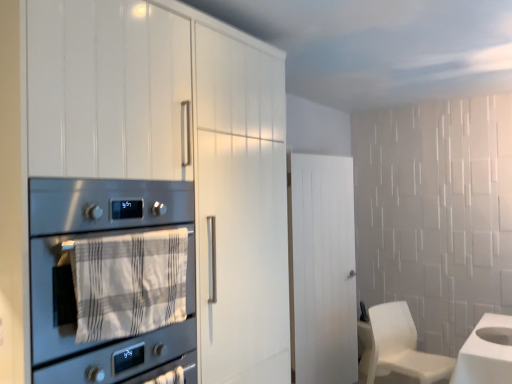
At what (x,y) coordinates should I click in order to perform the action: click on white matte chair at lower right. Please return your answer as a coordinate pair (x, y). Looking at the image, I should click on [x=398, y=347].

Image resolution: width=512 pixels, height=384 pixels. Describe the element at coordinates (398, 347) in the screenshot. I see `white matte chair at lower right` at that location.

What do you see at coordinates (178, 149) in the screenshot? I see `white matte cabinet at left` at bounding box center [178, 149].

This screenshot has height=384, width=512. Find the location of `stainless steel oven at left`. stainless steel oven at left is located at coordinates (100, 237).

Can you tell me how much white matte cabinet at left and white matte chair at lower right differ in facing direction?

There is a 18.8-degree angle between the facing directions of white matte cabinet at left and white matte chair at lower right.

From a real-world perspective, is white matte cabinet at left physically located above or below white matte chair at lower right?

white matte cabinet at left is situated higher than white matte chair at lower right in the real world.

Does white matte cabinet at left come behind white matte chair at lower right?

That is False.

Is white matte cabinet at left facing towards white matte chair at lower right?

No, white matte cabinet at left is not oriented towards white matte chair at lower right.

Is white wood door at center to the left or to the right of white matte cabinet at left in the image?

From the image, it's evident that white wood door at center is to the right of white matte cabinet at left.

In the scene shown: Is white wood door at center behind white matte cabinet at left?

Yes, the depth of white wood door at center is greater than that of white matte cabinet at left.

From a real-world perspective, is white wood door at center positioned over white matte cabinet at left based on gravity?

No, from a real-world perspective, white wood door at center is not on top of white matte cabinet at left.

The image size is (512, 384). In the image, there is a white matte cabinet at left. Identify the location of door below it (from a real-world perspective). (322, 269).

Who is shorter, stainless steel oven at left or white textured towel at center?

Standing shorter between the two is white textured towel at center.

Considering the positions of objects stainless steel oven at left and white textured towel at center in the image provided, who is in front, stainless steel oven at left or white textured towel at center?

stainless steel oven at left is more forward.

From a real-world perspective, is stainless steel oven at left positioned over white textured towel at center based on gravity?

No, from a real-world perspective, stainless steel oven at left is not above white textured towel at center.

Who is bigger, stainless steel oven at left or white textured towel at center?

With larger size is stainless steel oven at left.

Could white textured towel at center be considered to be inside white matte chair at lower right?

No, white textured towel at center is not inside white matte chair at lower right.

Can you confirm if white matte chair at lower right is shorter than white textured towel at center?

Incorrect, the height of white matte chair at lower right does not fall short of that of white textured towel at center.

Based on the photo, is white matte chair at lower right turned away from white textured towel at center?

No, white matte chair at lower right's orientation is not away from white textured towel at center.

Is point (380, 315) positioned in front of point (154, 301)?

That is False.

Which is farther, (49,300) or (196,149)?

Positioned behind is point (196,149).

From a real-world perspective, is stainless steel oven at left located beneath white matte cabinet at left?

Correct, in the physical world, stainless steel oven at left is lower than white matte cabinet at left.

Between stainless steel oven at left and white matte cabinet at left, which one has more height?

white matte cabinet at left is taller.

Is stainless steel oven at left in contact with white matte cabinet at left?

No, stainless steel oven at left is not next to white matte cabinet at left.

Is there a large distance between white wood door at center and white matte chair at lower right?

No, white wood door at center is not far from white matte chair at lower right.

Which is behind, white wood door at center or white matte chair at lower right?

white wood door at center.

From the image's perspective, between white wood door at center and white matte chair at lower right, who is located below?

white matte chair at lower right, from the image's perspective.

Considering the sizes of objects white wood door at center and white matte chair at lower right in the image provided, who is taller, white wood door at center or white matte chair at lower right?

white wood door at center.

In terms of width, does white wood door at center look wider or thinner when compared to stainless steel oven at left?

Considering their sizes, white wood door at center looks slimmer than stainless steel oven at left.

Is white wood door at center turned away from stainless steel oven at left?

white wood door at center is not turned away from stainless steel oven at left.

From the image's perspective, which one is positioned higher, white wood door at center or stainless steel oven at left?

stainless steel oven at left appears higher in the image.

Is point (313, 293) behind point (143, 342)?

Yes, point (313, 293) is behind point (143, 342).

At what (x,y) coordinates should I click in order to perform the action: click on cabinetry above the white matte chair at lower right (from a real-world perspective). Please return your answer as a coordinate pair (x, y). This screenshot has height=384, width=512. Looking at the image, I should click on (178, 149).

Find the location of `cabinetry above the white wood door at center (from the image's perspective)`. cabinetry above the white wood door at center (from the image's perspective) is located at coordinates (178, 149).

Estimate the real-world distances between objects in this image. Which object is closer to white matte cabinet at left, white wood door at center or stainless steel oven at left?

The object closer to white matte cabinet at left is stainless steel oven at left.

Considering their positions, is white matte cabinet at left positioned closer to white wood door at center than white matte chair at lower right?

Based on the image, white matte chair at lower right appears to be nearer to white wood door at center.

From the image, which object appears to be nearer to white matte chair at lower right, white wood door at center or stainless steel oven at left?

white wood door at center lies closer to white matte chair at lower right than the other object.

Based on their spatial positions, is white matte cabinet at left or stainless steel oven at left further from white textured towel at center?

white matte cabinet at left is further to white textured towel at center.

Considering their positions, is white matte chair at lower right positioned closer to white wood door at center than white textured towel at center?

white matte chair at lower right is closer to white wood door at center.

Estimate the real-world distances between objects in this image. Which object is closer to white matte chair at lower right, white textured towel at center or stainless steel oven at left?

stainless steel oven at left.

Looking at the image, which one is located closer to white matte cabinet at left, white matte chair at lower right or stainless steel oven at left?

stainless steel oven at left is positioned closer to the anchor white matte cabinet at left.

From the image, which object appears to be nearer to white textured towel at center, white matte cabinet at left or white wood door at center?

white matte cabinet at left lies closer to white textured towel at center than the other object.

What are the coordinates of `cabinetry located between stainless steel oven at left and white matte chair at lower right in the left-right direction` in the screenshot? It's located at (x=178, y=149).

At what (x,y) coordinates should I click in order to perform the action: click on chair positioned between stainless steel oven at left and white wood door at center from near to far. Please return your answer as a coordinate pair (x, y). Looking at the image, I should click on (398, 347).

Find the location of a particular element. The height and width of the screenshot is (384, 512). blanket between stainless steel oven at left and white wood door at center in the front-back direction is located at coordinates (129, 283).

Where is `blanket located between white matte cabinet at left and white matte chair at lower right in the depth direction`? blanket located between white matte cabinet at left and white matte chair at lower right in the depth direction is located at coordinates (129, 283).